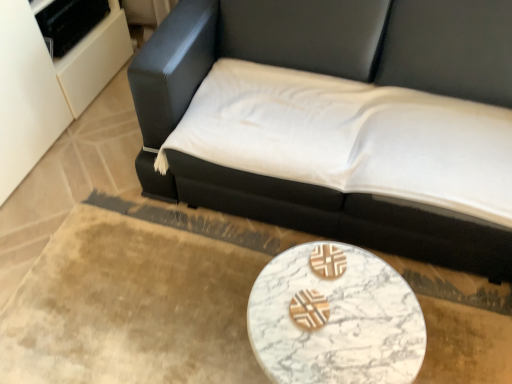
Question: Considering the relative sizes of black leather studio couch at upper center and white marble table at lower center in the image provided, is black leather studio couch at upper center shorter than white marble table at lower center?

Choices:
 (A) no
 (B) yes

Answer: (A)

Question: Is black leather studio couch at upper center further to the viewer compared to white marble table at lower center?

Choices:
 (A) no
 (B) yes

Answer: (A)

Question: Is black leather studio couch at upper center smaller than white marble table at lower center?

Choices:
 (A) no
 (B) yes

Answer: (A)

Question: Can you see black leather studio couch at upper center touching white marble table at lower center?

Choices:
 (A) yes
 (B) no

Answer: (B)

Question: Can we say black leather studio couch at upper center lies outside white marble table at lower center?

Choices:
 (A) yes
 (B) no

Answer: (A)

Question: Considering the relative sizes of black leather studio couch at upper center and white marble table at lower center in the image provided, is black leather studio couch at upper center bigger than white marble table at lower center?

Choices:
 (A) no
 (B) yes

Answer: (B)

Question: Does white marble table at lower center appear on the right side of black leather studio couch at upper center?

Choices:
 (A) yes
 (B) no

Answer: (B)

Question: From the image's perspective, is white marble table at lower center on top of black leather studio couch at upper center?

Choices:
 (A) no
 (B) yes

Answer: (A)

Question: Does white marble table at lower center have a lesser width compared to black leather studio couch at upper center?

Choices:
 (A) yes
 (B) no

Answer: (A)

Question: Does white marble table at lower center have a greater width compared to black leather studio couch at upper center?

Choices:
 (A) yes
 (B) no

Answer: (B)

Question: From a real-world perspective, is white marble table at lower center below black leather studio couch at upper center?

Choices:
 (A) no
 (B) yes

Answer: (B)

Question: Is the position of white marble table at lower center less distant than that of black leather studio couch at upper center?

Choices:
 (A) no
 (B) yes

Answer: (A)

Question: Considering the positions of point (349, 365) and point (199, 3), is point (349, 365) closer or farther from the camera than point (199, 3)?

Choices:
 (A) closer
 (B) farther

Answer: (A)